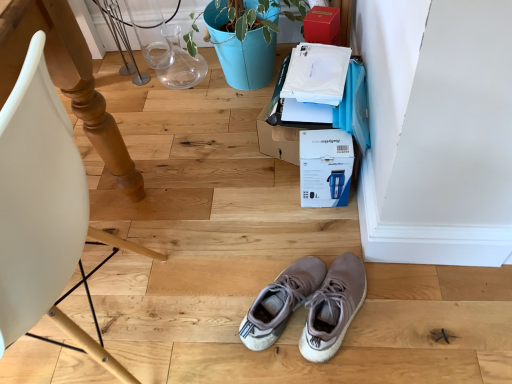
This screenshot has width=512, height=384. Identify the location of free point above blue cardboard box at center, which is the second cardboard box in top-to-bottom order (from a real-world perspective). (328, 125).